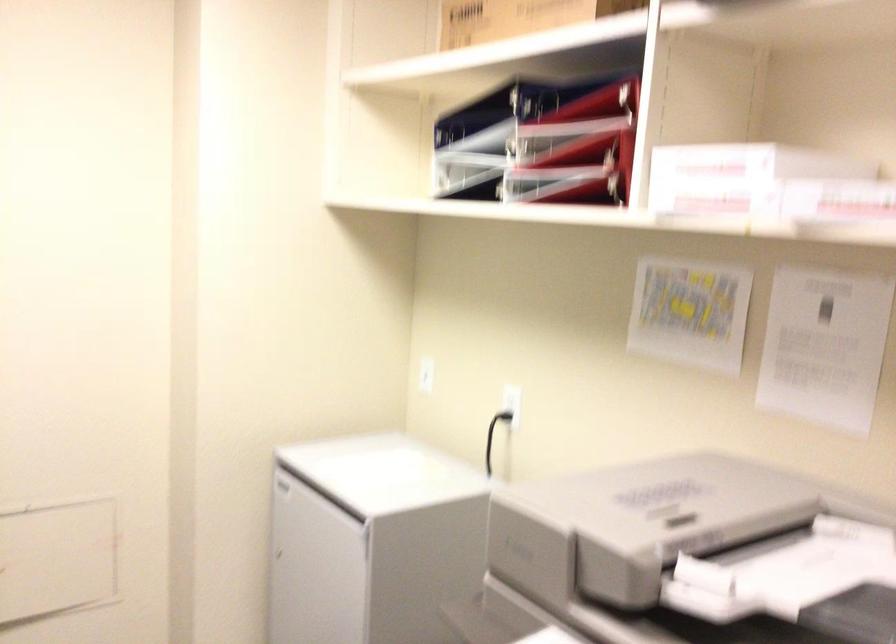
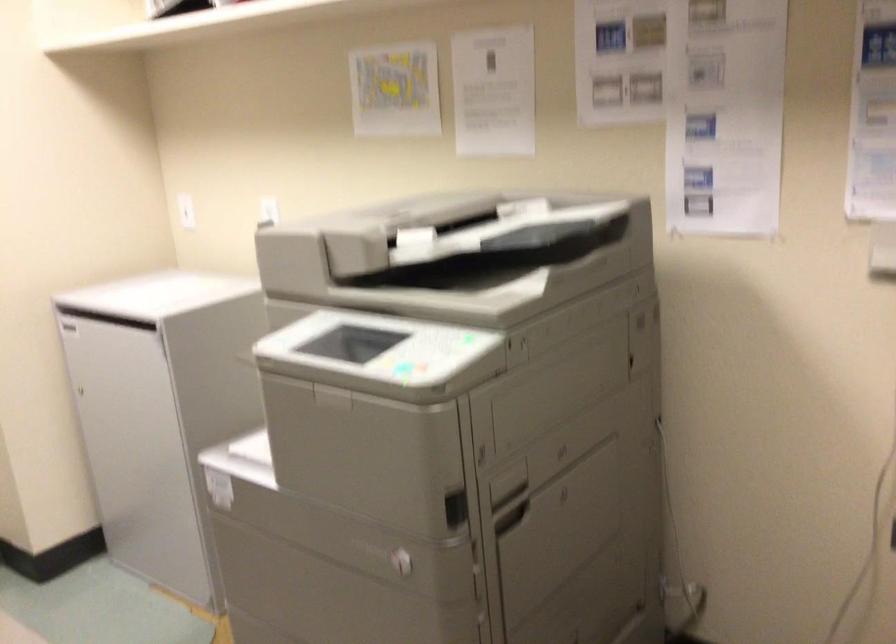
Where in the second image is the point corresponding to [819,346] from the first image?

(494, 91)